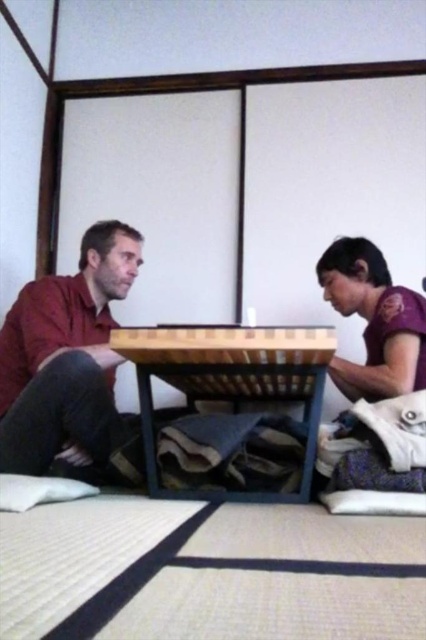
Can you confirm if matte wood table at center is thinner than bamboo table at center?

Indeed, matte wood table at center has a lesser width compared to bamboo table at center.

Where is `matte wood table at center`? matte wood table at center is located at coordinates (66, 358).

Can you confirm if matte wood table at center is shorter than purple matte shirt at lower right?

No.

Is matte wood table at center taller than purple matte shirt at lower right?

Indeed, matte wood table at center has a greater height compared to purple matte shirt at lower right.

Who is more forward, (69,420) or (397,339)?

Point (69,420) is more forward.

Image resolution: width=426 pixels, height=640 pixels. I want to click on matte wood table at center, so click(66, 358).

Is bamboo table at center to the left of purple matte shirt at lower right from the viewer's perspective?

Correct, you'll find bamboo table at center to the left of purple matte shirt at lower right.

Who is positioned more to the left, bamboo table at center or purple matte shirt at lower right?

bamboo table at center

Does point (157, 483) lie in front of point (393, 296)?

Yes.

Find the location of a particular element. bamboo table at center is located at coordinates point(230,381).